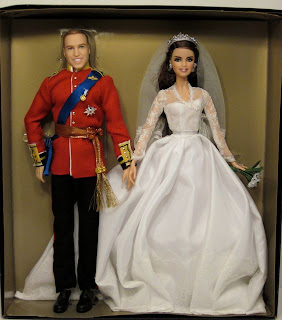
This screenshot has height=320, width=282. I want to click on doll 1, so click(188, 124).